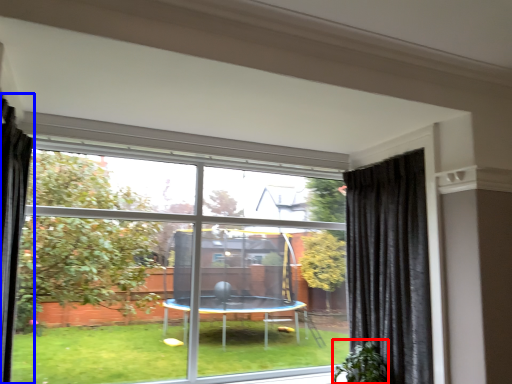
Question: Which object is further to the camera taking this photo, plant (highlighted by a red box) or curtain (highlighted by a blue box)?

Choices:
 (A) plant
 (B) curtain

Answer: (A)